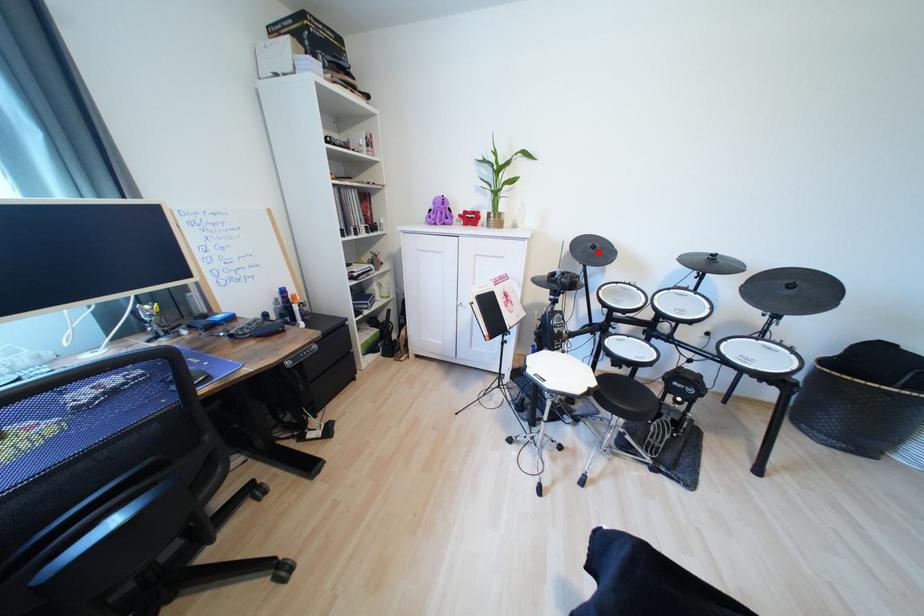
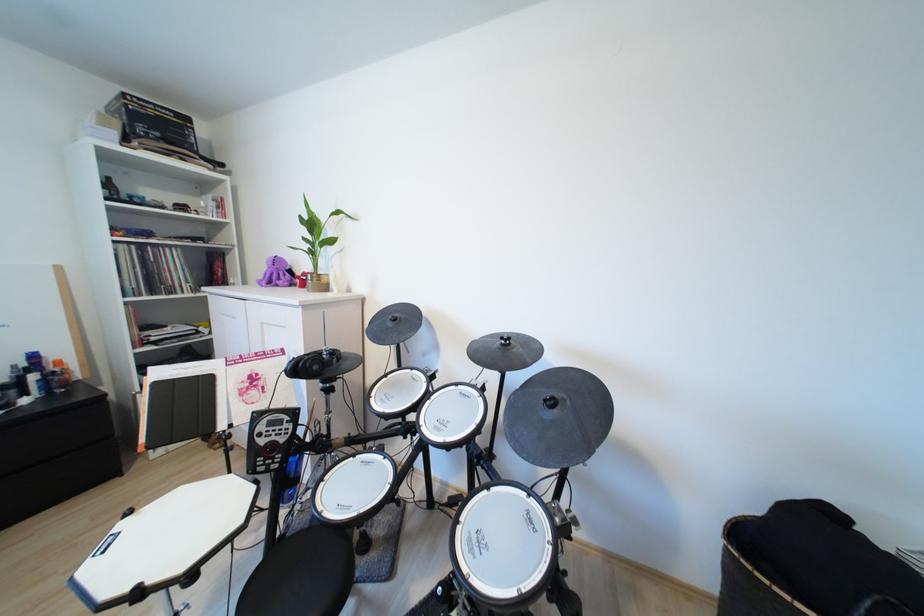
Locate, in the second image, the point that corresponds to the highlighted location in the first image.

(396, 325)